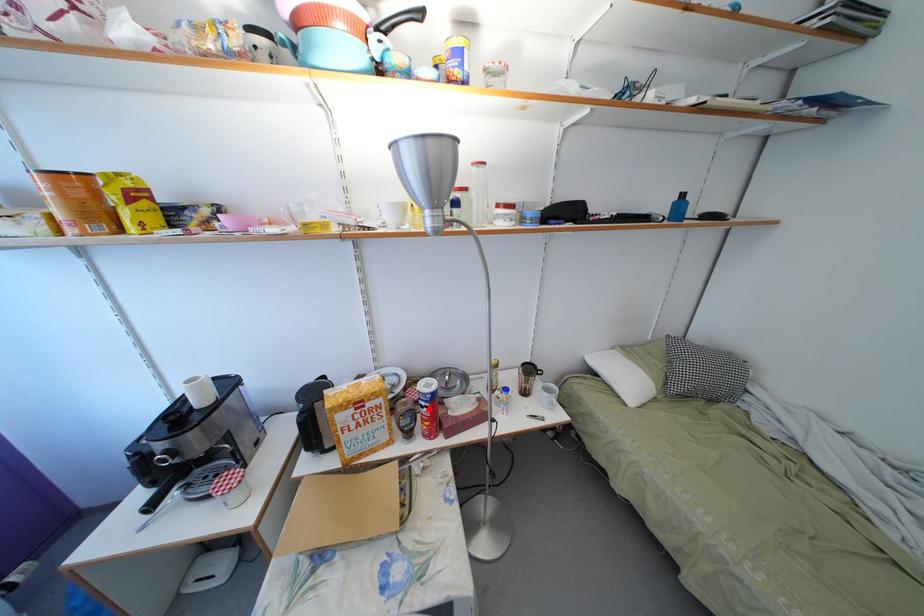
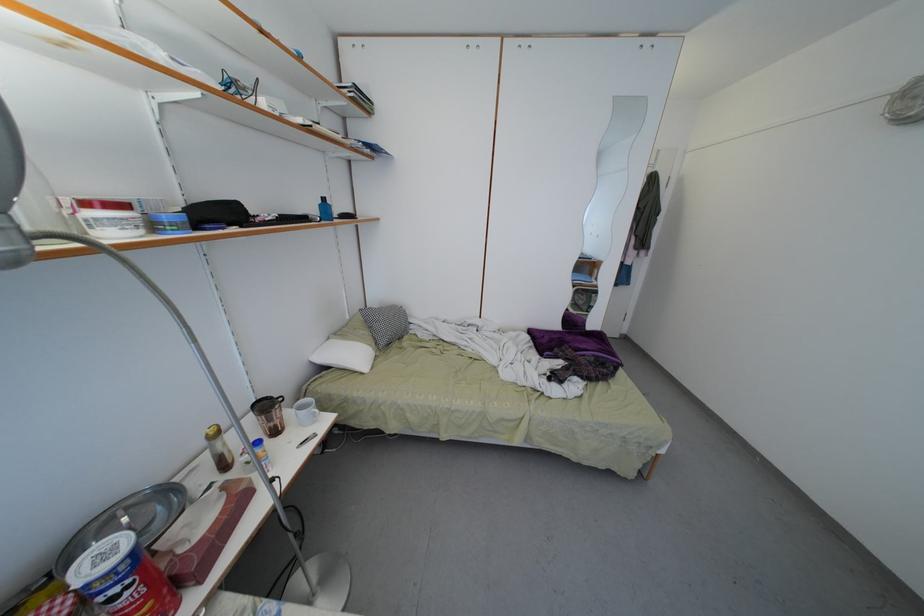
Where in the second image is the point corresponding to the highlighted location from the first image?

(120, 596)